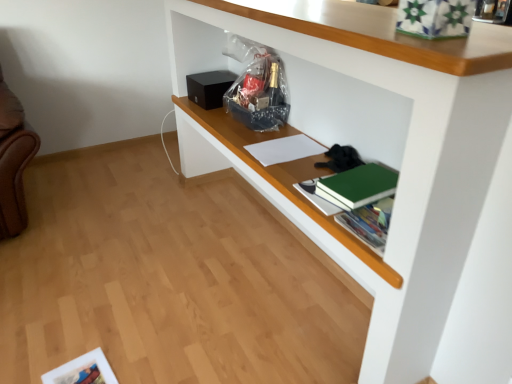
Question: Do you think green matte book at center-right is within white matte shelf at upper center, or outside of it?

Choices:
 (A) inside
 (B) outside

Answer: (A)

Question: From their relative heights in the image, would you say green matte book at center-right is taller or shorter than white matte shelf at upper center?

Choices:
 (A) tall
 (B) short

Answer: (B)

Question: Which of these objects is positioned closest to the white matte shelf at upper center?

Choices:
 (A) green matte book at center-right
 (B) white paper at center

Answer: (A)

Question: Which object is positioned farthest from the white matte shelf at upper center?

Choices:
 (A) white paper at center
 (B) green matte book at center-right

Answer: (A)